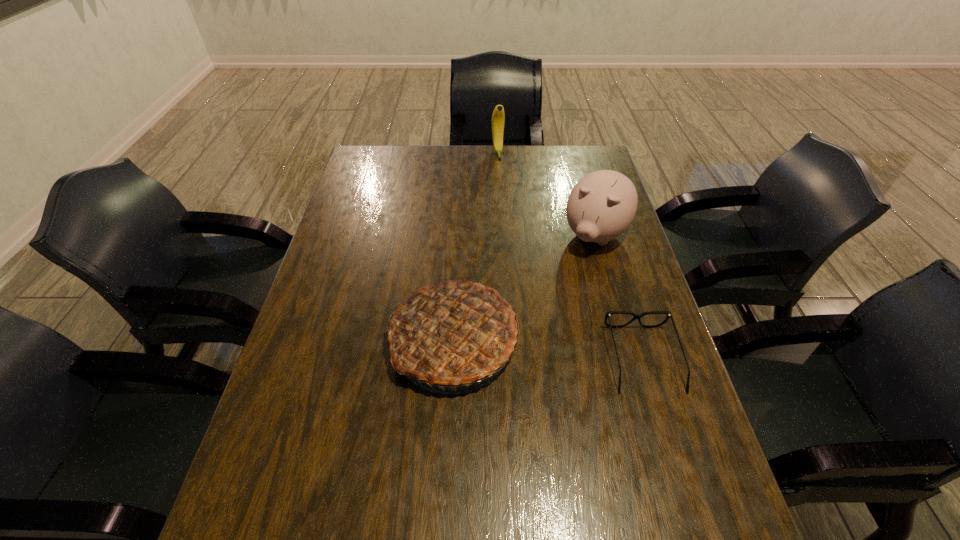
At what (x,y) coordinates should I click in order to perform the action: click on pie. Please return your answer as a coordinate pair (x, y). The height and width of the screenshot is (540, 960). Looking at the image, I should click on (453, 333).

This screenshot has width=960, height=540. Find the location of `the shortest object`. the shortest object is located at coordinates (636, 316).

This screenshot has width=960, height=540. In order to click on banana in this screenshot , I will do `click(498, 117)`.

I want to click on the third nearest object, so [x=602, y=205].

I want to click on vacant position located 0.070m on the right of the pie, so click(x=546, y=339).

Where is `blank space located with the lenses facing outward on the shortest object`? This screenshot has height=540, width=960. blank space located with the lenses facing outward on the shortest object is located at coordinates (672, 458).

Find the location of `vacant space situated 0.390m from the stem of the banana`. vacant space situated 0.390m from the stem of the banana is located at coordinates (512, 226).

Find the location of `blank space located 0.100m from the stem of the banana`. blank space located 0.100m from the stem of the banana is located at coordinates (501, 175).

Identify the location of free space located 0.330m from the stem of the banana. This screenshot has height=540, width=960. (509, 214).

The height and width of the screenshot is (540, 960). Identify the location of vacant space located at the snout of the piggy bank. (535, 338).